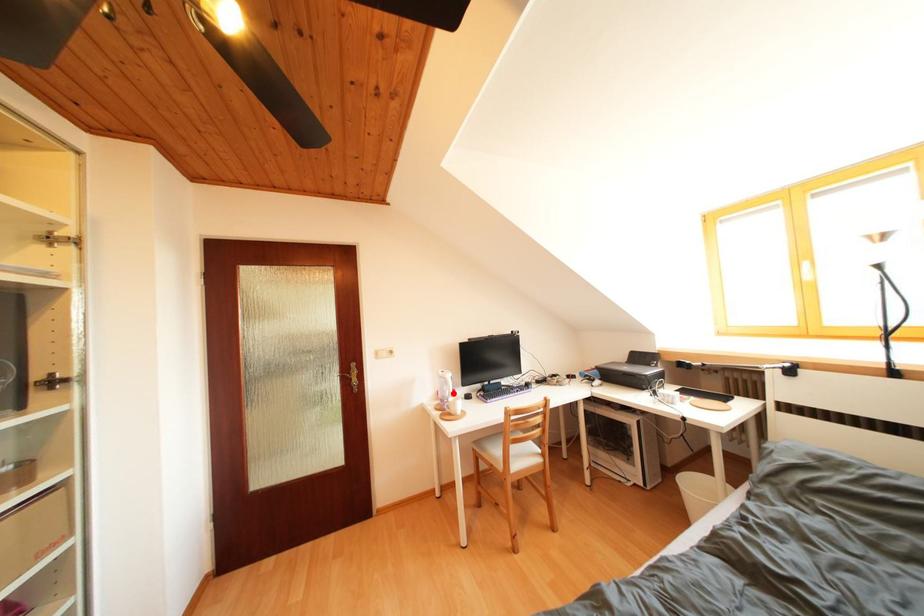
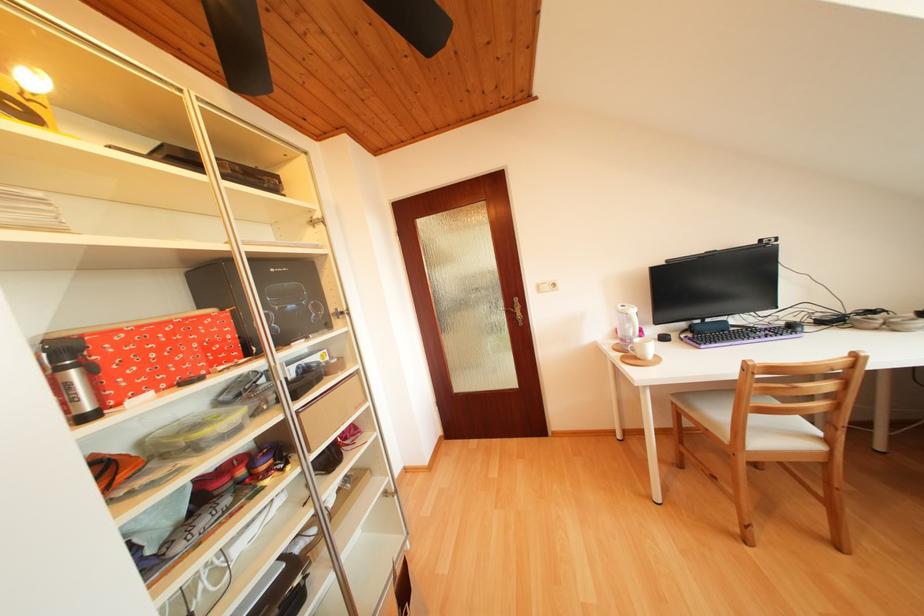
Question: A red point is marked in image1. In image2, is the corresponding 3D point closer to the camera or farther? Reply with the corresponding letter.

Choices:
 (A) The corresponding 3D point is closer.
 (B) The corresponding 3D point is farther.

Answer: (A)